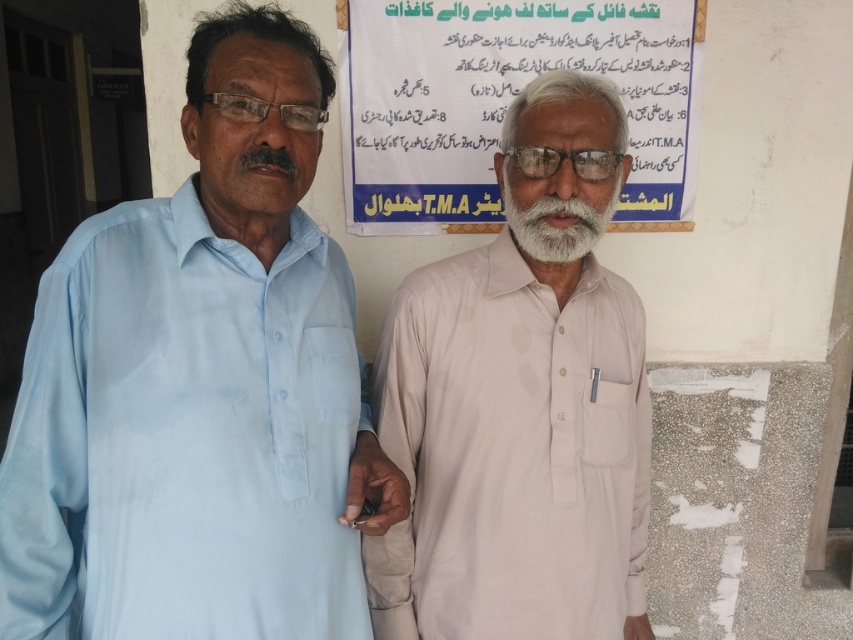
Question: Which point is closer to the camera?

Choices:
 (A) (233, 209)
 (B) (410, 211)

Answer: (A)

Question: Which object is positioned closest to the light beige cotton shirt at center?

Choices:
 (A) white soft beard at center
 (B) white paper at upper center

Answer: (A)

Question: Does light beige cotton shirt at center have a lesser width compared to white soft beard at center?

Choices:
 (A) no
 (B) yes

Answer: (A)

Question: Which of the following is the closest to the observer?

Choices:
 (A) [416, 173]
 (B) [410, 627]

Answer: (B)

Question: Where is light blue cotton shirt at left located in relation to light beige cotton shirt at center in the image?

Choices:
 (A) above
 (B) below

Answer: (A)

Question: Does light beige cotton shirt at center appear over white paper at upper center?

Choices:
 (A) no
 (B) yes

Answer: (A)